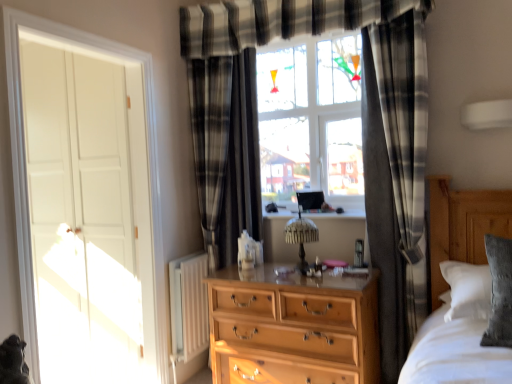
Question: Does white matte door at left come behind black plaid curtain at center, the 2th curtain when ordered from front to back?

Choices:
 (A) yes
 (B) no

Answer: (B)

Question: Are white matte door at left and black plaid curtain at center, the 2th curtain when ordered from front to back, making contact?

Choices:
 (A) no
 (B) yes

Answer: (A)

Question: Can you confirm if white matte door at left is thinner than black plaid curtain at center, the 1th curtain viewed from the left?

Choices:
 (A) yes
 (B) no

Answer: (B)

Question: From the image's perspective, is white matte door at left above black plaid curtain at center, the 1th curtain viewed from the left?

Choices:
 (A) no
 (B) yes

Answer: (A)

Question: Is white matte door at left at the right side of black plaid curtain at center, the 2th curtain when ordered from front to back?

Choices:
 (A) yes
 (B) no

Answer: (B)

Question: Is white matte door at left not inside black plaid curtain at center, which appears as the second curtain when viewed from the right?

Choices:
 (A) yes
 (B) no

Answer: (A)

Question: From a real-world perspective, is black plaid curtain at right, the 1th curtain in the front-to-back sequence, physically below white matte door at left?

Choices:
 (A) yes
 (B) no

Answer: (B)

Question: Does black plaid curtain at right, which is counted as the first curtain, starting from the right, have a lesser width compared to white matte door at left?

Choices:
 (A) no
 (B) yes

Answer: (A)

Question: Are black plaid curtain at right, the 1th curtain in the front-to-back sequence, and white matte door at left making contact?

Choices:
 (A) yes
 (B) no

Answer: (B)

Question: From a real-world perspective, does black plaid curtain at right, the second curtain viewed from the left, stand above white matte door at left?

Choices:
 (A) yes
 (B) no

Answer: (A)

Question: Can you confirm if black plaid curtain at right, the second curtain viewed from the left, is smaller than white matte door at left?

Choices:
 (A) yes
 (B) no

Answer: (A)

Question: Can you confirm if black plaid curtain at right, the 1th curtain in the front-to-back sequence, is wider than white matte door at left?

Choices:
 (A) no
 (B) yes

Answer: (B)

Question: Considering the relative sizes of black plaid curtain at center, the 1th curtain viewed from the left, and silvery fur cat at lower left in the image provided, is black plaid curtain at center, the 1th curtain viewed from the left, taller than silvery fur cat at lower left?

Choices:
 (A) yes
 (B) no

Answer: (A)